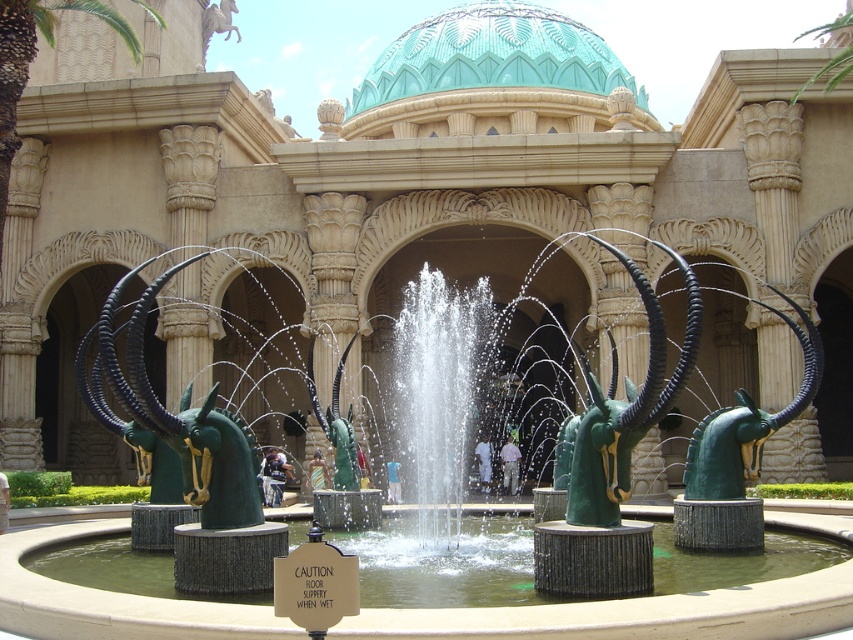
Can you confirm if green matte sculpture at center is positioned to the left of green leafy palm tree at upper left?

Incorrect, green matte sculpture at center is not on the left side of green leafy palm tree at upper left.

Which is above, green matte sculpture at center or green leafy palm tree at upper left?

green leafy palm tree at upper left

Image resolution: width=853 pixels, height=640 pixels. In order to click on green matte sculpture at center in this screenshot , I will do `click(177, 417)`.

Is point (837, 61) in front of point (285, 474)?

Yes, point (837, 61) is in front of point (285, 474).

Does point (838, 32) lie behind point (277, 477)?

Yes, it is behind point (277, 477).

Which is in front, point (827, 26) or point (265, 454)?

Point (265, 454) is in front.

Where is `green leafy palm tree at upper center`? The height and width of the screenshot is (640, 853). green leafy palm tree at upper center is located at coordinates (830, 72).

Does green polished stone fountain at center appear on the right side of green matte sculpture at center?

Yes, green polished stone fountain at center is to the right of green matte sculpture at center.

Who is positioned more to the left, green polished stone fountain at center or green matte sculpture at center?

From the viewer's perspective, green matte sculpture at center appears more on the left side.

Is point (22, 593) more distant than point (190, 499)?

No, it is in front of (190, 499).

The image size is (853, 640). Identify the location of green polished stone fountain at center. (640, 614).